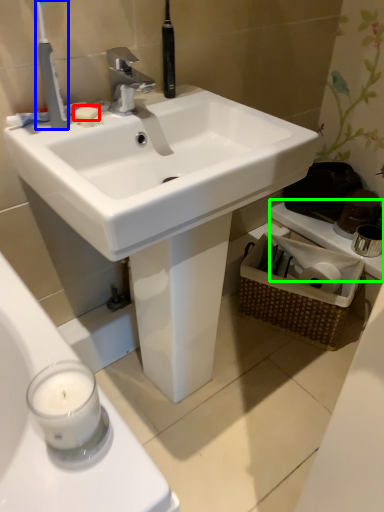
Question: Estimate the real-world distances between objects in this image. Which object is closer to soap (highlighted by a red box), toothbrush (highlighted by a blue box) or counter top (highlighted by a green box)?

Choices:
 (A) toothbrush
 (B) counter top

Answer: (A)